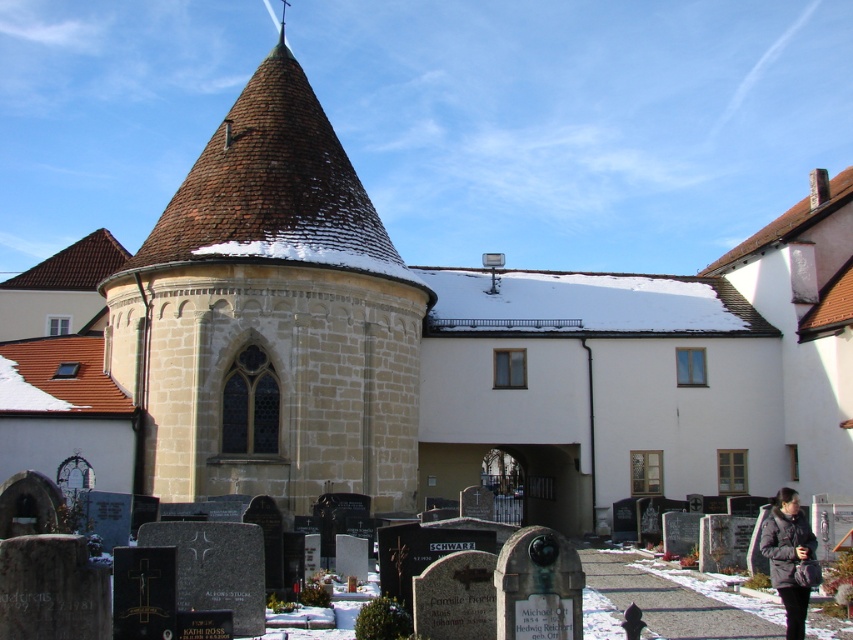
Can you confirm if stone tower at center is positioned above black fuzzy coat at lower right?

Yes.

Can you confirm if stone tower at center is positioned below black fuzzy coat at lower right?

Actually, stone tower at center is above black fuzzy coat at lower right.

Identify the location of stone tower at center. (270, 317).

I want to click on stone tower at center, so 270,317.